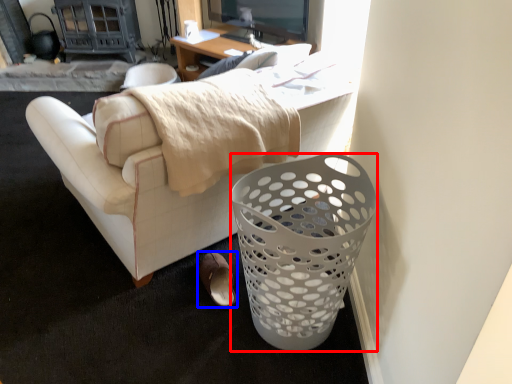
Question: Which object appears farthest to the camera in this image, trash bin/can (highlighted by a red box) or footwear (highlighted by a blue box)?

Choices:
 (A) trash bin/can
 (B) footwear

Answer: (B)